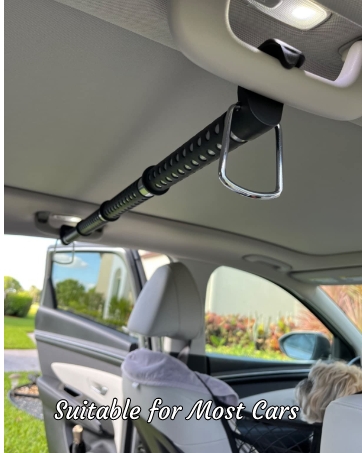
Find the location of a particular element. The image size is (362, 453). handle is located at coordinates (220, 178).